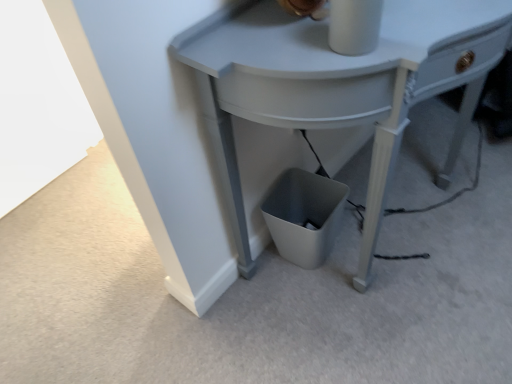
Identify the location of matte white table at center. This screenshot has height=384, width=512. (337, 83).

What is the approximate height of matte white table at center?

matte white table at center is 30.54 inches tall.

Describe the element at coordinates (337, 83) in the screenshot. I see `matte white table at center` at that location.

Find the location of a particular element. The height and width of the screenshot is (384, 512). matte white table at center is located at coordinates (337, 83).